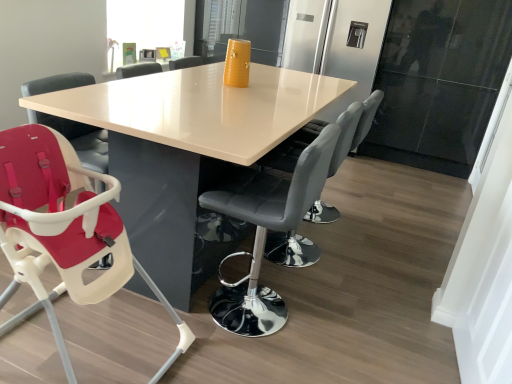
Locate an element on the screen. empty space that is to the right of black leather bar stool at center, the 2th chair viewed from the right is located at coordinates (340, 320).